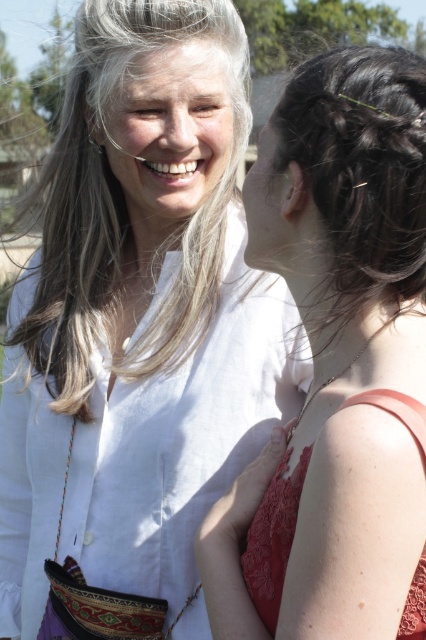
You are a photographer standing at the camera position. You want to take a portrait of the smooth white face at upper center. Since the subject is 10.04 feet away, will you need to adjust your camera focus to ensure clarity?

The smooth white face at upper center is 10.04 feet away from the camera. Most cameras have an auto focus feature that can handle this distance without needing manual adjustment, so you don